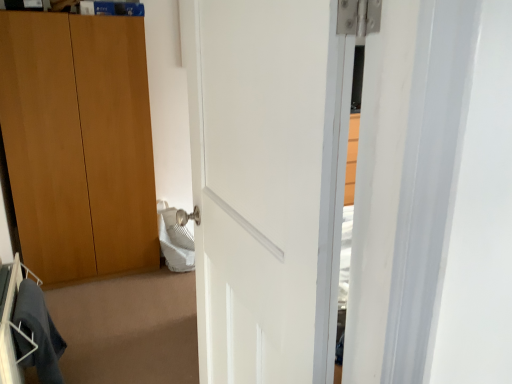
Question: Does white glossy door at center have a greater width compared to dark gray fabric at lower left?

Choices:
 (A) yes
 (B) no

Answer: (A)

Question: Does white glossy door at center have a lesser width compared to dark gray fabric at lower left?

Choices:
 (A) no
 (B) yes

Answer: (A)

Question: Is white glossy door at center bigger than dark gray fabric at lower left?

Choices:
 (A) yes
 (B) no

Answer: (A)

Question: Is white glossy door at center to the left of dark gray fabric at lower left from the viewer's perspective?

Choices:
 (A) no
 (B) yes

Answer: (A)

Question: Is white glossy door at center outside dark gray fabric at lower left?

Choices:
 (A) no
 (B) yes

Answer: (B)

Question: Are white glossy door at center and dark gray fabric at lower left far apart?

Choices:
 (A) no
 (B) yes

Answer: (B)

Question: Is dark gray fabric at lower left touching white glossy door at center?

Choices:
 (A) yes
 (B) no

Answer: (B)

Question: Can you confirm if dark gray fabric at lower left is positioned to the right of white glossy door at center?

Choices:
 (A) yes
 (B) no

Answer: (B)

Question: Can you confirm if dark gray fabric at lower left is bigger than white glossy door at center?

Choices:
 (A) yes
 (B) no

Answer: (B)

Question: Is white glossy door at center surrounded by dark gray fabric at lower left?

Choices:
 (A) no
 (B) yes

Answer: (A)

Question: Is dark gray fabric at lower left at the left side of white glossy door at center?

Choices:
 (A) no
 (B) yes

Answer: (B)

Question: From the image's perspective, is dark gray fabric at lower left located above white glossy door at center?

Choices:
 (A) yes
 (B) no

Answer: (B)

Question: Considering the positions of dark gray fabric at lower left and white glossy door at center in the image, is dark gray fabric at lower left taller or shorter than white glossy door at center?

Choices:
 (A) short
 (B) tall

Answer: (A)